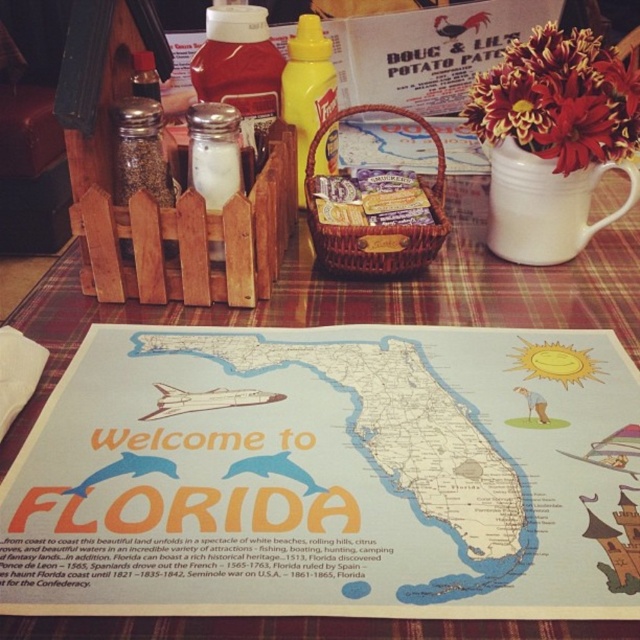
Is wooden placemat at center bigger than yellow matte mustard at center?

Yes, wooden placemat at center is bigger than yellow matte mustard at center.

Can you confirm if wooden placemat at center is smaller than yellow matte mustard at center?

Actually, wooden placemat at center might be larger than yellow matte mustard at center.

Describe the element at coordinates (365, 296) in the screenshot. The width and height of the screenshot is (640, 640). I see `wooden placemat at center` at that location.

Find the location of a particular element. The height and width of the screenshot is (640, 640). wooden placemat at center is located at coordinates (365, 296).